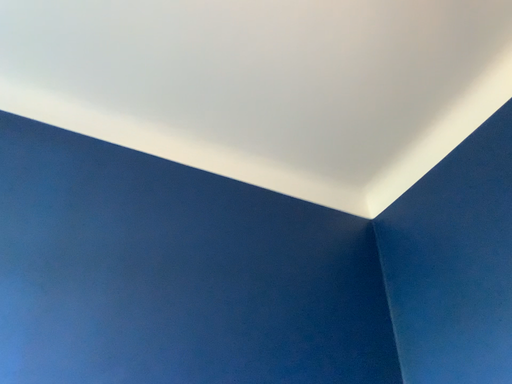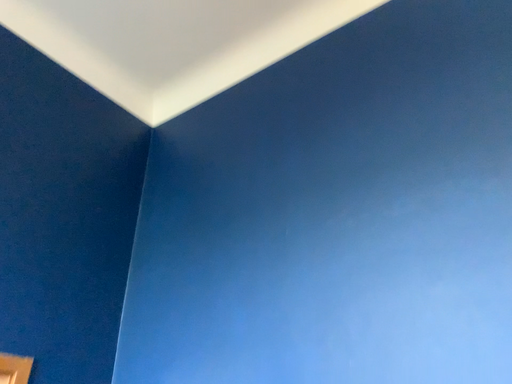
Question: Which way did the camera rotate in the video?

Choices:
 (A) rotated upward
 (B) rotated downward

Answer: (B)